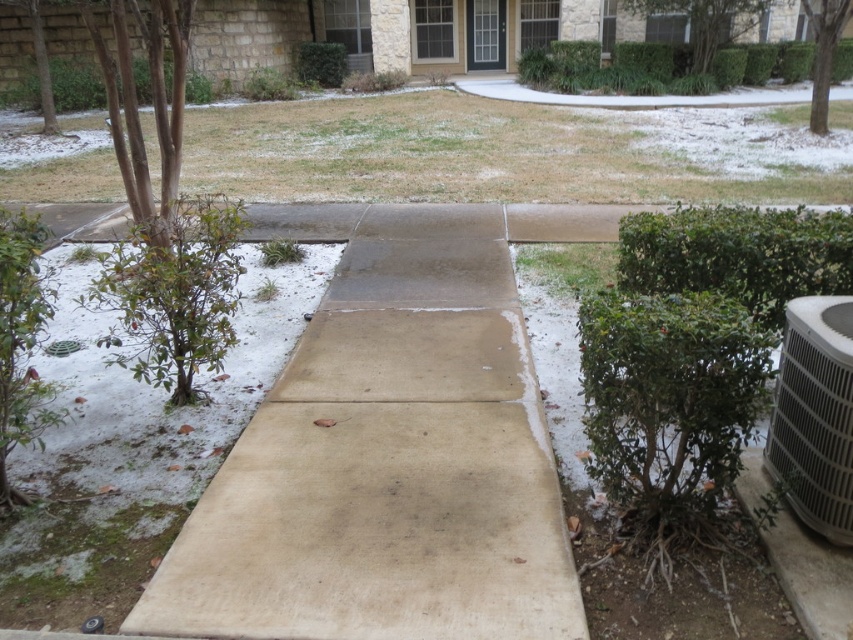
In the scene shown: You are standing at the entrance of the house and want to install a new light fixture. The gray metallic air conditioner at lower right and the green leafy hedge at upper center are in your way. Which object should you move first to access the area behind them?

You should move the gray metallic air conditioner at lower right first because it is positioned under the green leafy hedge at upper center, so moving the lower one first would allow access to the area behind both.

You are a gardener planning to trim both the green leafy bush at right and the green leafy hedge at upper left. Which one requires more effort in terms of horizontal space coverage?

The green leafy bush at right requires more effort in terms of horizontal space coverage because its width surpasses that of the green leafy hedge at upper left.